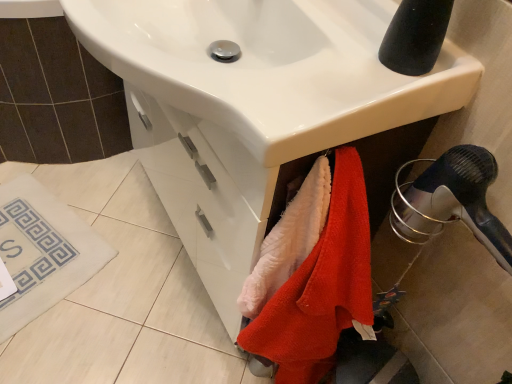
Question: Which is correct: fluffy pink towel at lower center, acting as the second beach towel starting from the bottom, is inside white glossy sink at center, or outside of it?

Choices:
 (A) outside
 (B) inside

Answer: (A)

Question: Is point (316, 175) closer or farther from the camera than point (128, 43)?

Choices:
 (A) farther
 (B) closer

Answer: (A)

Question: Considering the real-world distances, which object is closest to the fluffy pink towel at lower center, which is the first beach towel in top-to-bottom order?

Choices:
 (A) black rubber tap at upper right
 (B) fluffy orange towel at lower right, which is the 1th beach towel in bottom-to-top order
 (C) white glossy sink at center
 (D) white fabric bath mat at lower left
 (E) black plastic hair dryer at lower right

Answer: (B)

Question: Estimate the real-world distances between objects in this image. Which object is closer to the white fabric bath mat at lower left?

Choices:
 (A) white glossy sink at center
 (B) black rubber tap at upper right
 (C) fluffy pink towel at lower center, which is the first beach towel in top-to-bottom order
 (D) fluffy orange towel at lower right, which is the 2th beach towel from top to bottom
 (E) black plastic hair dryer at lower right

Answer: (D)